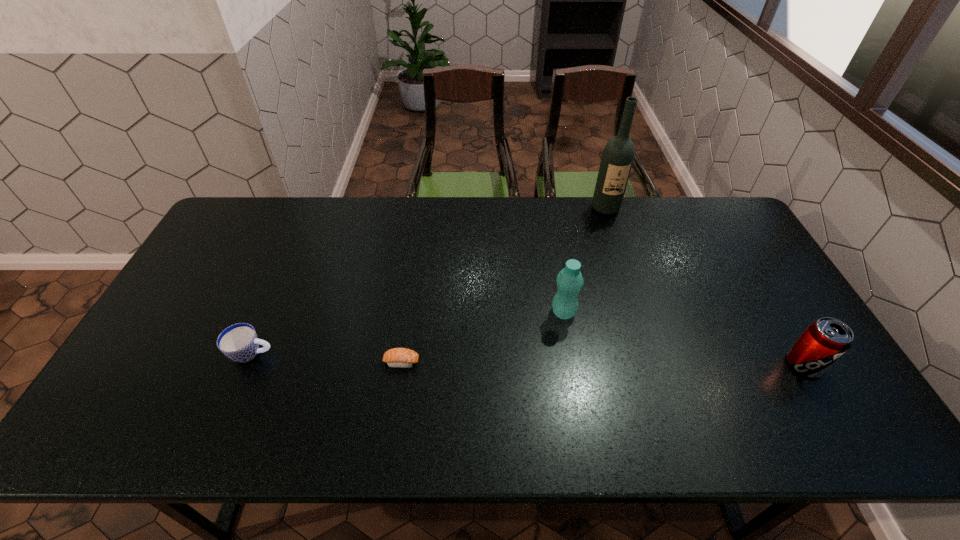
Identify the location of empty space that is in between the third tallest object and the second shortest object. [528, 359].

Identify which object is the third closest to the fourth object from right to left. Please provide its 2D coordinates. Your answer should be formatted as a tuple, i.e. [(x, y)], where the tuple contains the x and y coordinates of a point satisfying the conditions above.

[(617, 159)]

This screenshot has width=960, height=540. I want to click on object that stands as the fourth closest to the cup, so click(x=826, y=340).

What are the coordinates of `blank area in the image that satisfies the following two spatial constraints: 1. on the back side of the rightmost object; 2. on the side of the second shortest object with the handle` in the screenshot? It's located at (798, 353).

Where is `free space that satisfies the following two spatial constraints: 1. on the side of the fourth tallest object with the handle; 2. on the back side of the second object from left to right`? free space that satisfies the following two spatial constraints: 1. on the side of the fourth tallest object with the handle; 2. on the back side of the second object from left to right is located at coordinates (248, 362).

Locate an element on the screen. Image resolution: width=960 pixels, height=540 pixels. blank space that satisfies the following two spatial constraints: 1. on the side of the cup with the handle; 2. on the right side of the sushi is located at coordinates (248, 362).

This screenshot has width=960, height=540. I want to click on free spot that satisfies the following two spatial constraints: 1. on the back side of the shortest object; 2. on the side of the cup with the handle, so click(x=402, y=353).

Where is `free space that satisfies the following two spatial constraints: 1. on the side of the leftmost object with the handle; 2. on the right side of the sushi`? The width and height of the screenshot is (960, 540). free space that satisfies the following two spatial constraints: 1. on the side of the leftmost object with the handle; 2. on the right side of the sushi is located at coordinates (248, 362).